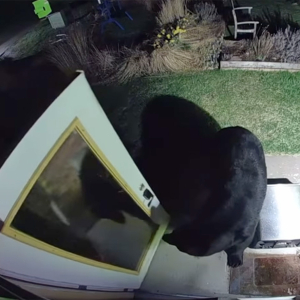
The height and width of the screenshot is (300, 300). Find the location of `yellow frame`. yellow frame is located at coordinates tap(86, 136).